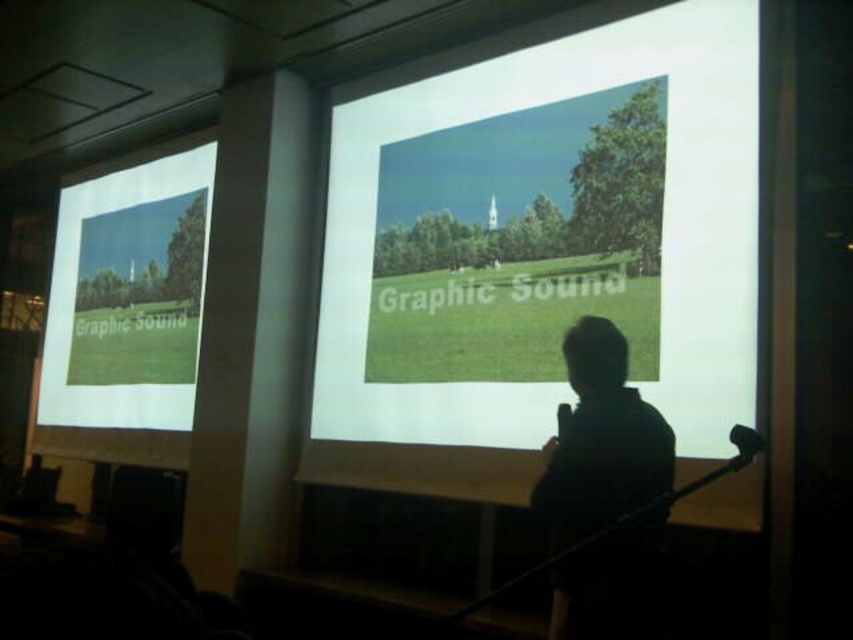
Question: Can you confirm if green grassy field at center is bigger than silhouette human at center?

Choices:
 (A) yes
 (B) no

Answer: (A)

Question: Which object is closer to the camera taking this photo?

Choices:
 (A) green grassy field at center
 (B) silhouette human at center

Answer: (B)

Question: Which point is closer to the camera taking this photo?

Choices:
 (A) tap(119, 340)
 (B) tap(368, 381)
 (C) tap(576, 540)

Answer: (C)

Question: Is green grassy field at center smaller than matte white screen at left?

Choices:
 (A) no
 (B) yes

Answer: (A)

Question: Is green grassy field at center below matte white screen at left?

Choices:
 (A) yes
 (B) no

Answer: (B)

Question: Which point is closer to the camera?

Choices:
 (A) matte white screen at left
 (B) green grassy field at center

Answer: (B)